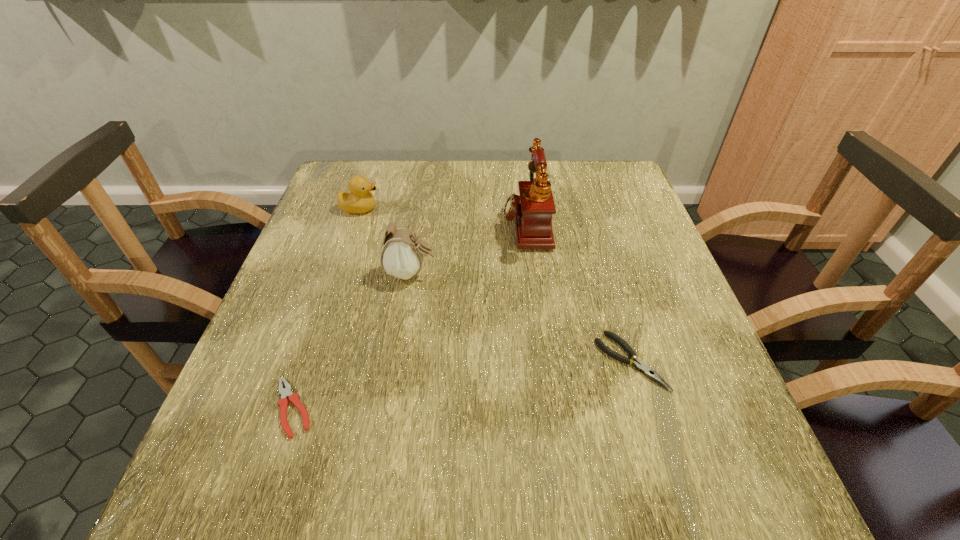
Find the location of a particular element. object positioned at the right edge is located at coordinates (650, 373).

Identify the location of object located at the far left corner. pyautogui.click(x=359, y=200).

Find the location of a particular element. This screenshot has height=540, width=960. vacant area at the far edge is located at coordinates (485, 184).

Find the location of a particular element. free spot at the near edge of the desktop is located at coordinates click(x=347, y=485).

Locate an element on the screen. This screenshot has height=540, width=960. free space at the left edge of the desktop is located at coordinates (241, 441).

Locate an element on the screen. free space at the right edge of the desktop is located at coordinates (639, 258).

Locate an element on the screen. The image size is (960, 540). vacant region at the far right corner of the desktop is located at coordinates (604, 169).

Locate an element on the screen. The height and width of the screenshot is (540, 960). vacant space at the near right corner of the desktop is located at coordinates tap(689, 507).

Where is `empty location between the pouch and the second object from right to left`? Image resolution: width=960 pixels, height=540 pixels. empty location between the pouch and the second object from right to left is located at coordinates (468, 248).

Image resolution: width=960 pixels, height=540 pixels. I want to click on free spot between the pouch and the telephone, so click(468, 248).